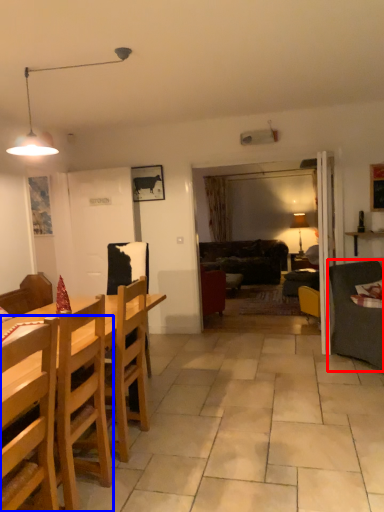
Question: Which point is closer to the camera, studio couch (highlighted by a red box) or chair (highlighted by a blue box)?

Choices:
 (A) studio couch
 (B) chair

Answer: (B)